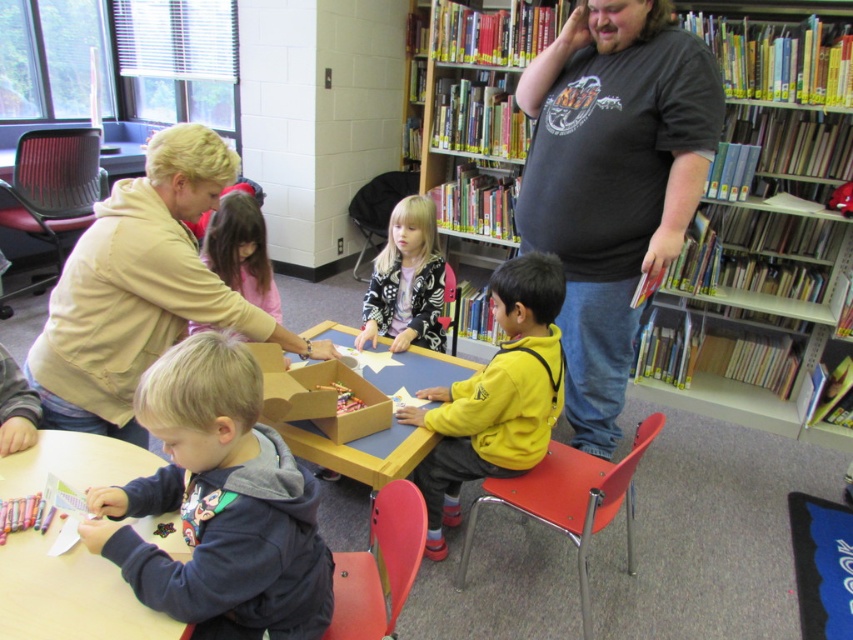
You are a teacher observing the children at the wooden table at center and the blonde hair girl at center. Which object is taller?

The blonde hair girl at center is taller than the wooden table at center.

You are a child sitting at the smooth wooden table at lower left and want to reach a book on the wooden bookshelf at upper right. Can you stretch your arm to grab it without moving your chair?

The wooden bookshelf at upper right is bigger than the smooth wooden table at lower left, but this does not indicate the distance between them. You need more information about the distance to determine if you can reach the book.